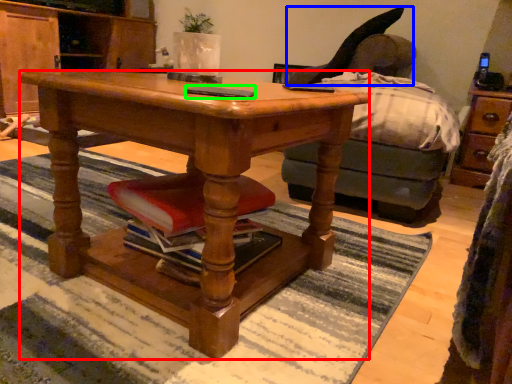
Question: Based on their relative distances, which object is nearer to desk (highlighted by a red box)? Choose from swivel chair (highlighted by a blue box) and mobile phone (highlighted by a green box).

Choices:
 (A) swivel chair
 (B) mobile phone

Answer: (B)